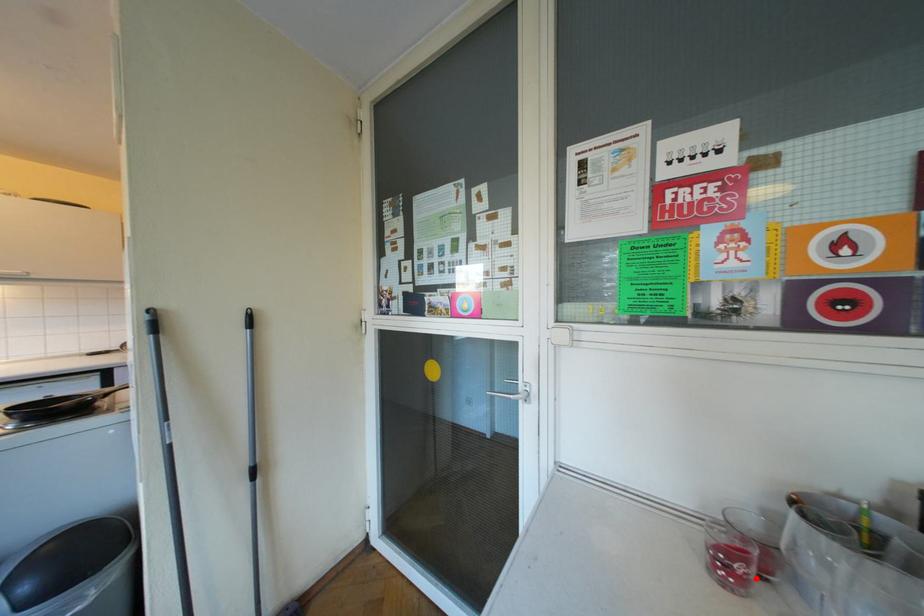
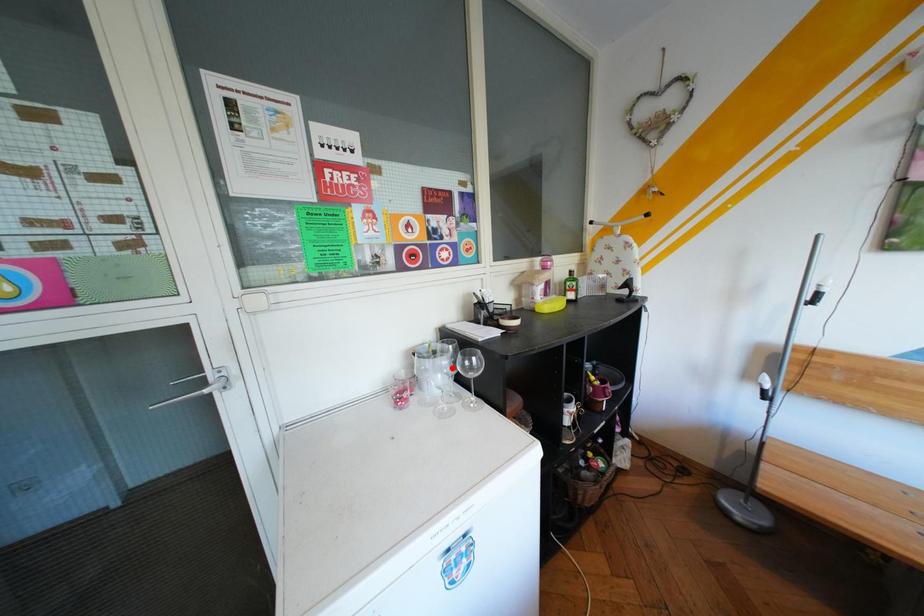
I am providing you with two images of the same scene from different viewpoints. A red point is marked on the first image and another point is marked on the second image. Are the points marked in image1 and image2 representing the same 3D position?

No